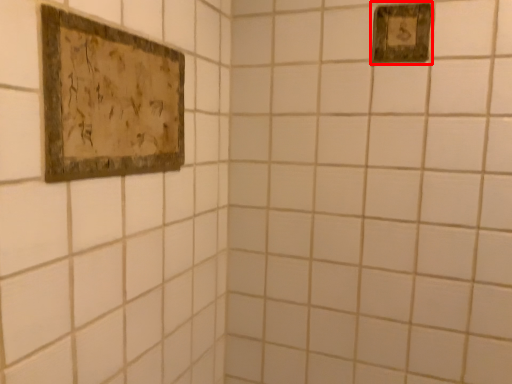
Question: Where is picture frame (annotated by the red box) located in relation to picture frame in the image?

Choices:
 (A) right
 (B) left

Answer: (A)